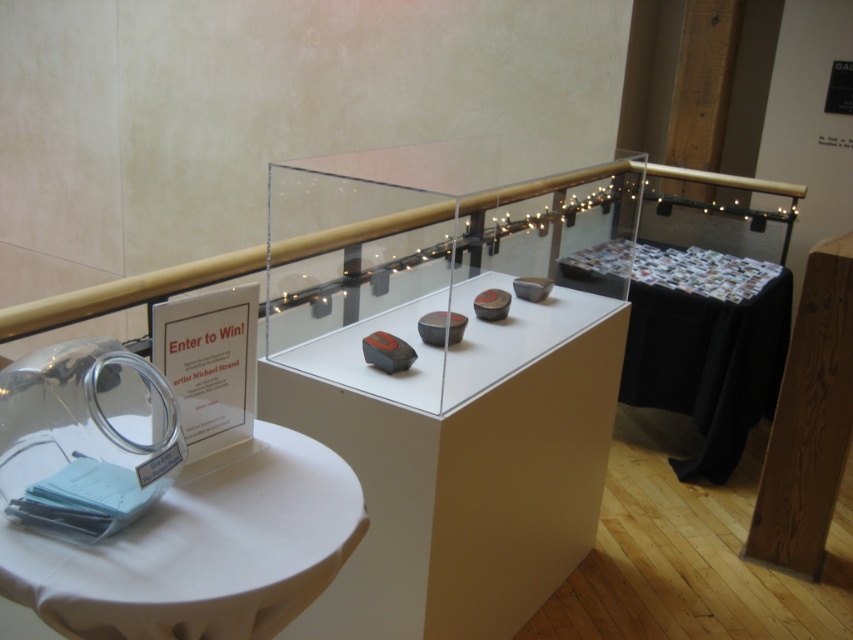
Does white cloth-covered table at lower left have a greater width compared to black fabric table at center?

No.

Is white cloth-covered table at lower left to the left of black fabric table at center from the viewer's perspective?

Indeed, white cloth-covered table at lower left is positioned on the left side of black fabric table at center.

Which is in front, point (256, 515) or point (698, 275)?

Point (256, 515) is more forward.

Identify the location of white cloth-covered table at lower left. (202, 548).

Between point (425, 625) and point (142, 596), which one is positioned in front?

Point (142, 596)

Is matte gray display case at center smaller than white cloth-covered table at lower left?

No.

Is point (465, 548) positioned after point (138, 616)?

Yes, it is.

Locate an element on the screen. The height and width of the screenshot is (640, 853). matte gray display case at center is located at coordinates (459, 460).

Measure the distance between matte gray display case at center and black fabric table at center.

matte gray display case at center is 39.37 inches from black fabric table at center.

Describe the element at coordinates (459, 460) in the screenshot. This screenshot has height=640, width=853. I see `matte gray display case at center` at that location.

Is point (543, 419) behind point (770, 280)?

No, (543, 419) is in front of (770, 280).

Where is `matte gray display case at center`? Image resolution: width=853 pixels, height=640 pixels. matte gray display case at center is located at coordinates (459, 460).